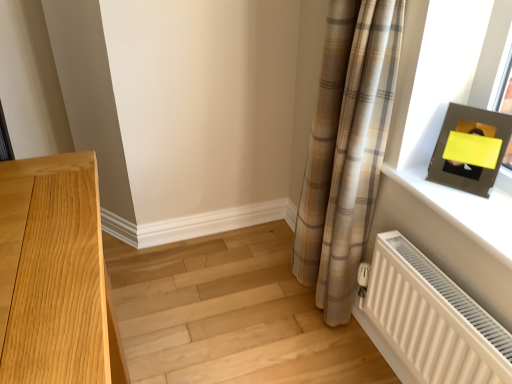
Question: From the image's perspective, is light wood floor at lower left above matte black frame at upper right?

Choices:
 (A) yes
 (B) no

Answer: (B)

Question: Would you consider light wood floor at lower left to be distant from matte black frame at upper right?

Choices:
 (A) no
 (B) yes

Answer: (A)

Question: Is light wood floor at lower left shorter than matte black frame at upper right?

Choices:
 (A) yes
 (B) no

Answer: (A)

Question: From a real-world perspective, is light wood floor at lower left positioned under matte black frame at upper right based on gravity?

Choices:
 (A) yes
 (B) no

Answer: (A)

Question: From the image's perspective, is light wood floor at lower left located beneath matte black frame at upper right?

Choices:
 (A) no
 (B) yes

Answer: (B)

Question: Is light wood floor at lower left thinner than matte black frame at upper right?

Choices:
 (A) no
 (B) yes

Answer: (A)

Question: Is light wood floor at lower left positioned behind white ribbed radiator at lower right?

Choices:
 (A) yes
 (B) no

Answer: (A)

Question: Can you confirm if light wood floor at lower left is thinner than white ribbed radiator at lower right?

Choices:
 (A) no
 (B) yes

Answer: (A)

Question: Can we say light wood floor at lower left lies outside white ribbed radiator at lower right?

Choices:
 (A) no
 (B) yes

Answer: (B)

Question: From a real-world perspective, does light wood floor at lower left sit lower than white ribbed radiator at lower right?

Choices:
 (A) no
 (B) yes

Answer: (B)

Question: Is light wood floor at lower left shorter than white ribbed radiator at lower right?

Choices:
 (A) no
 (B) yes

Answer: (B)

Question: Does light wood floor at lower left lie in front of white ribbed radiator at lower right?

Choices:
 (A) yes
 (B) no

Answer: (B)

Question: Does light wood floor at lower left contain matte black picture frame at upper right?

Choices:
 (A) yes
 (B) no

Answer: (B)